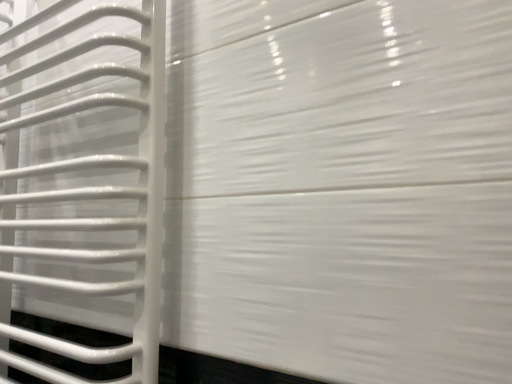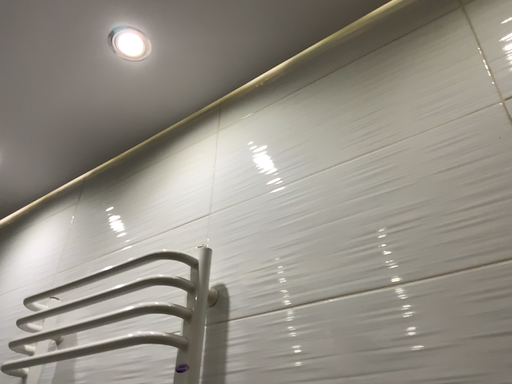
Question: How did the camera likely rotate when shooting the video?

Choices:
 (A) rotated upward
 (B) rotated downward

Answer: (A)